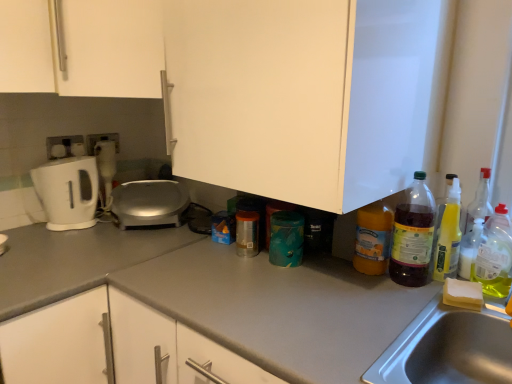
Locate an element on the screen. free space that is to the left of orange matte bottle at lower right, the first bottle in the left-to-right sequence is located at coordinates (314, 274).